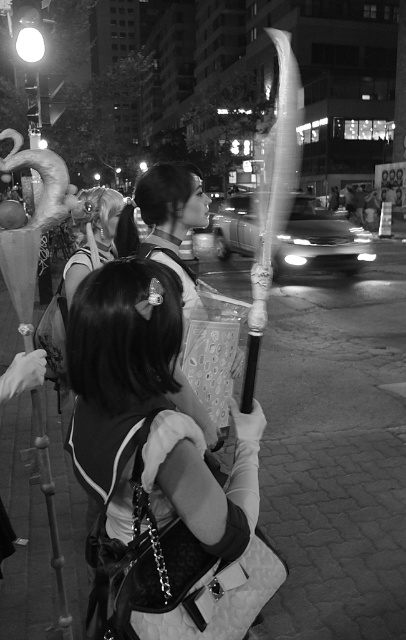
You are a photographer trying to capture a photo of the matte fabric kimono at center and the metallic streetlight at upper left. Which object should you focus on first if you want to ensure both are in sharp focus, considering their heights?

The matte fabric kimono at center is taller than the metallic streetlight at upper left, so focusing on the taller object first would help ensure both are in sharp focus.

You are a photographer trying to capture a closeup shot of the staff with the curved blade. You have two points marked in the image for focus. The first point is at coordinates point (177, 163) and the second point is at coordinates point (34, 56). Which point should you focus on to ensure the staff is in sharp focus?

Point (177, 163) is closer to the camera than point (34, 56), so focusing on point (177, 163) will ensure the staff with the curved blade is in sharp focus.

You are a photographer trying to capture the perfect shot of the matte black bag at center and the matte fabric kimono at center in the scene. Which object should you focus on first if you want to ensure both are in the frame without moving the camera?

The matte fabric kimono at center should be focused on first since it is above the matte black bag at center, making it easier to frame both objects by starting with the higher one.